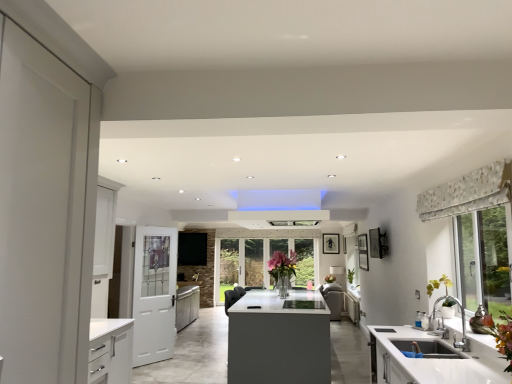
Question: Is patterned fabric valance at upper right outside of clear glass vase at center?

Choices:
 (A) yes
 (B) no

Answer: (A)

Question: Is patterned fabric valance at upper right at the right side of clear glass vase at center?

Choices:
 (A) no
 (B) yes

Answer: (B)

Question: Can you confirm if patterned fabric valance at upper right is smaller than clear glass vase at center?

Choices:
 (A) yes
 (B) no

Answer: (A)

Question: From a real-world perspective, is patterned fabric valance at upper right physically below clear glass vase at center?

Choices:
 (A) yes
 (B) no

Answer: (B)

Question: Is patterned fabric valance at upper right oriented towards clear glass vase at center?

Choices:
 (A) no
 (B) yes

Answer: (A)

Question: Would you say patterned fabric valance at upper right contains clear glass vase at center?

Choices:
 (A) no
 (B) yes

Answer: (A)

Question: From the image's perspective, is patterned fabric valance at upper right located above white glossy sink at lower right?

Choices:
 (A) yes
 (B) no

Answer: (A)

Question: Is patterned fabric valance at upper right not near white glossy sink at lower right?

Choices:
 (A) yes
 (B) no

Answer: (A)

Question: From a real-world perspective, does patterned fabric valance at upper right stand above white glossy sink at lower right?

Choices:
 (A) yes
 (B) no

Answer: (A)

Question: Can you confirm if patterned fabric valance at upper right is smaller than white glossy sink at lower right?

Choices:
 (A) yes
 (B) no

Answer: (A)

Question: Can you confirm if patterned fabric valance at upper right is shorter than white glossy sink at lower right?

Choices:
 (A) no
 (B) yes

Answer: (A)

Question: Does patterned fabric valance at upper right appear on the right side of white glossy sink at lower right?

Choices:
 (A) no
 (B) yes

Answer: (B)

Question: From the image's perspective, is clear glass vase at center below green matte plant at right?

Choices:
 (A) no
 (B) yes

Answer: (B)